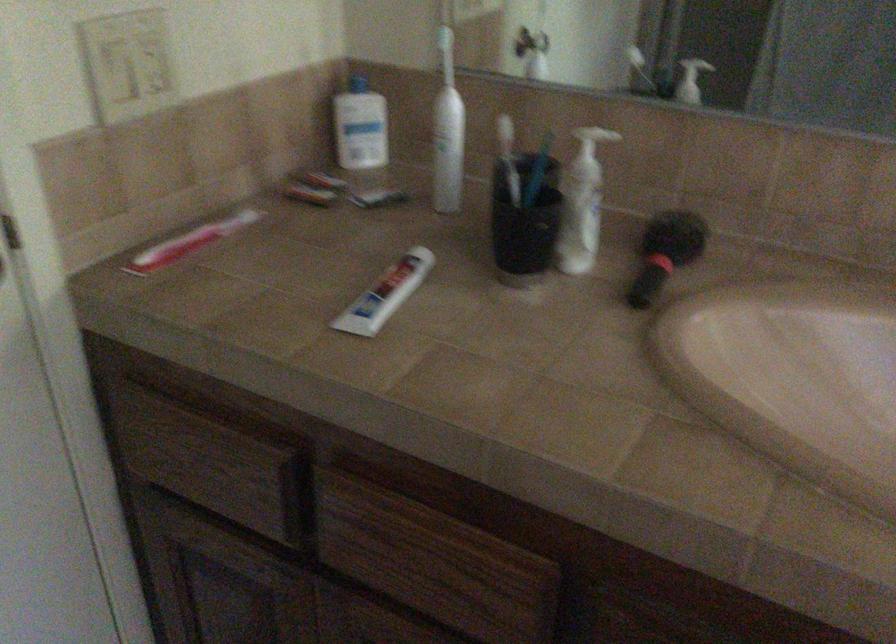
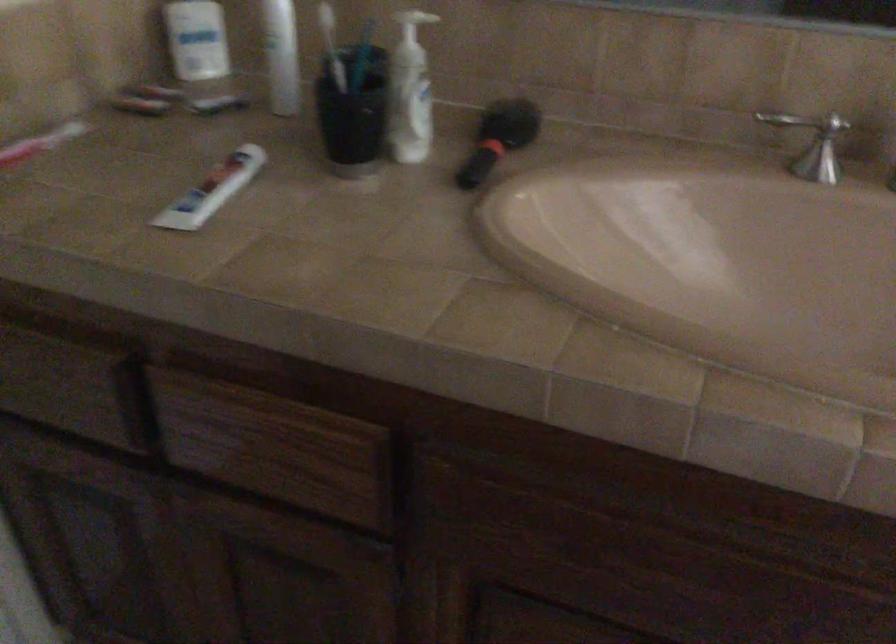
In the second image, find the point that corresponds to the point at 581,124 in the first image.

(412, 23)